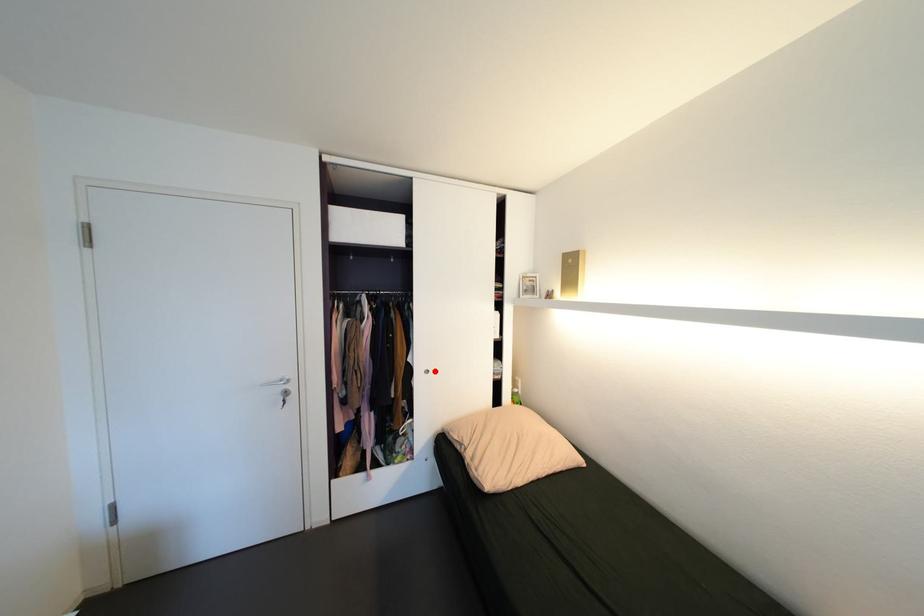
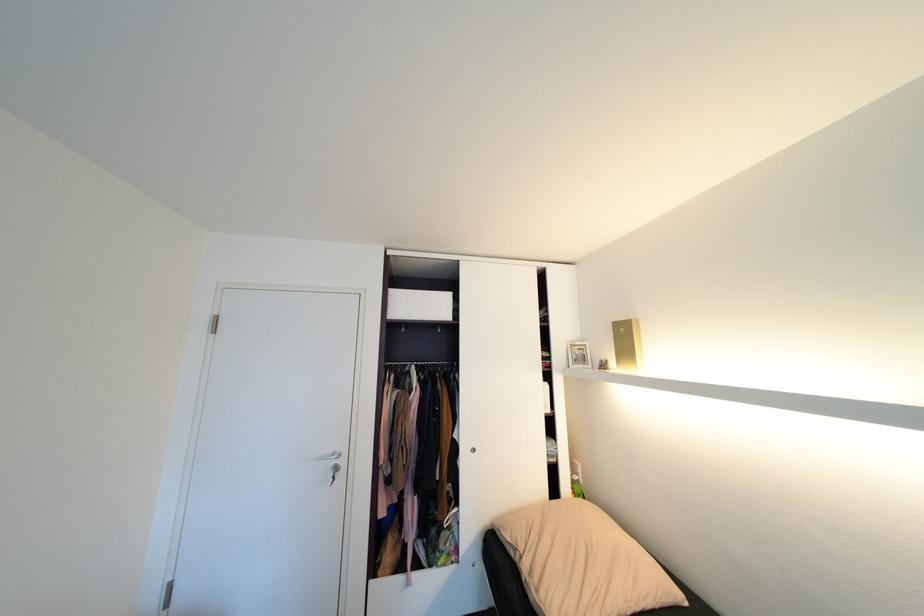
Locate, in the second image, the point that corresponds to the highlighted location in the first image.

(481, 450)